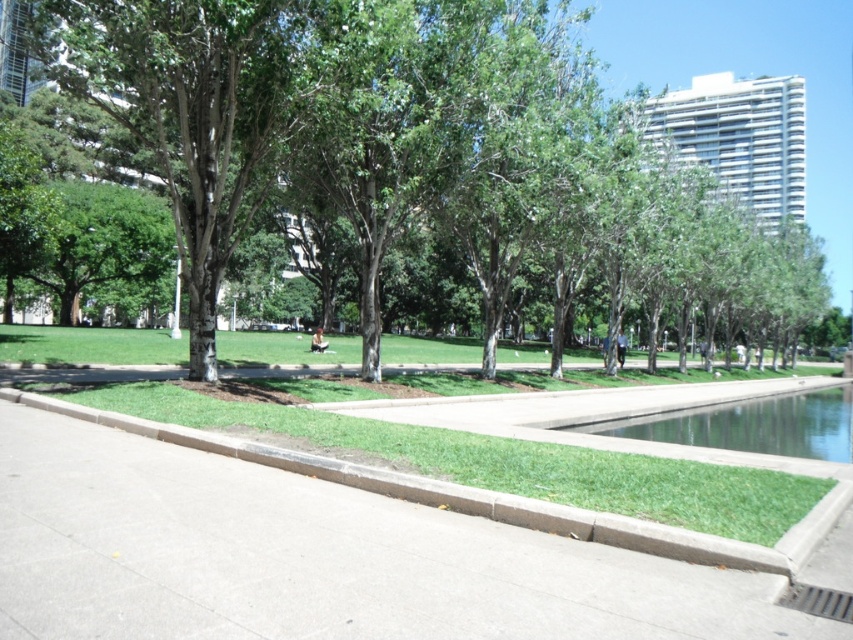
You are a park visitor standing at the entrance of the paved pathway. You want to take a photo of both the green leafy tree at center and the clear glass water at center. Which object should you focus on first to ensure both are in sharp focus?

You should focus on the green leafy tree at center first because it is closer to you than the clear glass water at center. By focusing on the closer object, the background object may still be in acceptable focus depending on the camera settings, but focusing on the farther object would likely blur the closer one.

You are a gardener planning to plant a new shrub between the green leafy tree at center and the concrete at center. Based on their positions, which object should you place the shrub closer to?

The concrete at center is behind the green leafy tree at center, so you should place the shrub closer to the concrete at center to ensure it is in front of the tree.

In the scene shown: You are planning to install a new bench in the park. The bench requires a minimum of 40 meters of space between the green leafy tree at center and the concrete at center for proper placement. Based on the scene, is there sufficient space available?

The distance between the green leafy tree at center and the concrete at center is 42.60 meters, which exceeds the required 40 meters. Therefore, there is sufficient space available for the bench installation.